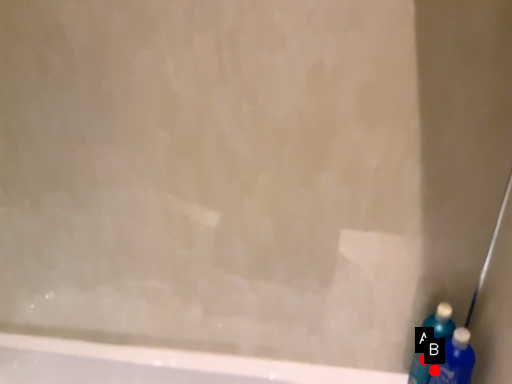
Question: Two points are circled on the image, labeled by A and B beside each circle. Which point is further to the camera?

Choices:
 (A) A is further
 (B) B is further

Answer: (A)